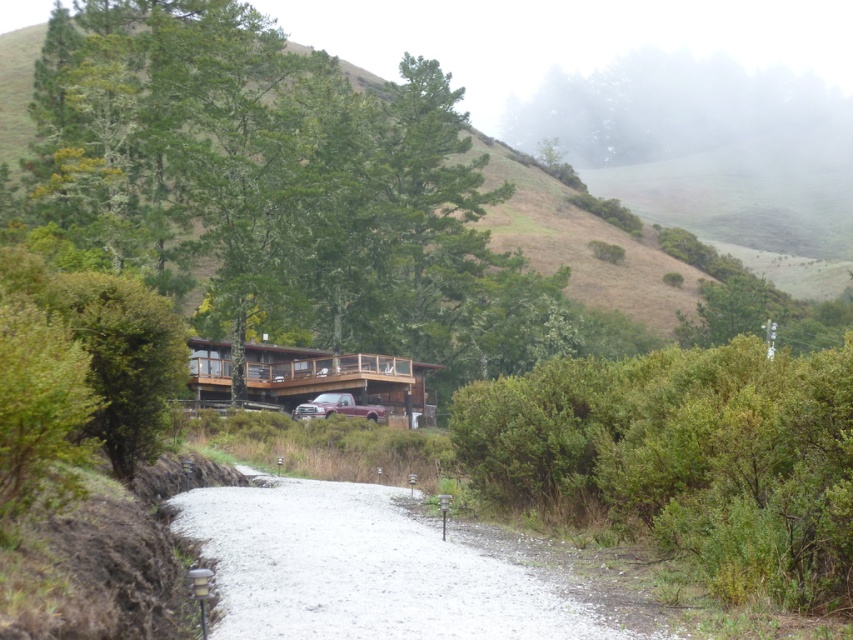
Can you confirm if foggy misty hillside at upper center is bigger than wooden cabin at center?

Indeed, foggy misty hillside at upper center has a larger size compared to wooden cabin at center.

Who is more forward, (663, 145) or (329, 385)?

Point (329, 385) is more forward.

Is point (582, 148) positioned in front of point (413, 406)?

No, it is not.

The height and width of the screenshot is (640, 853). Find the location of `foggy misty hillside at upper center`. foggy misty hillside at upper center is located at coordinates (665, 106).

Which is behind, point (532, 474) or point (294, 355)?

The point (294, 355) is behind.

Describe the element at coordinates (685, 458) in the screenshot. Image resolution: width=853 pixels, height=640 pixels. I see `green leafy bush at center` at that location.

What are the coordinates of `green leafy bush at center` in the screenshot? It's located at (685, 458).

Locate an element on the screen. green leafy bush at center is located at coordinates (685, 458).

Who is more forward, (312, 506) or (335, 403)?

Positioned in front is point (312, 506).

Does white gravel path at center have a larger size compared to metallic maroon truck at center?

Yes.

This screenshot has height=640, width=853. Find the location of `white gravel path at center`. white gravel path at center is located at coordinates (364, 570).